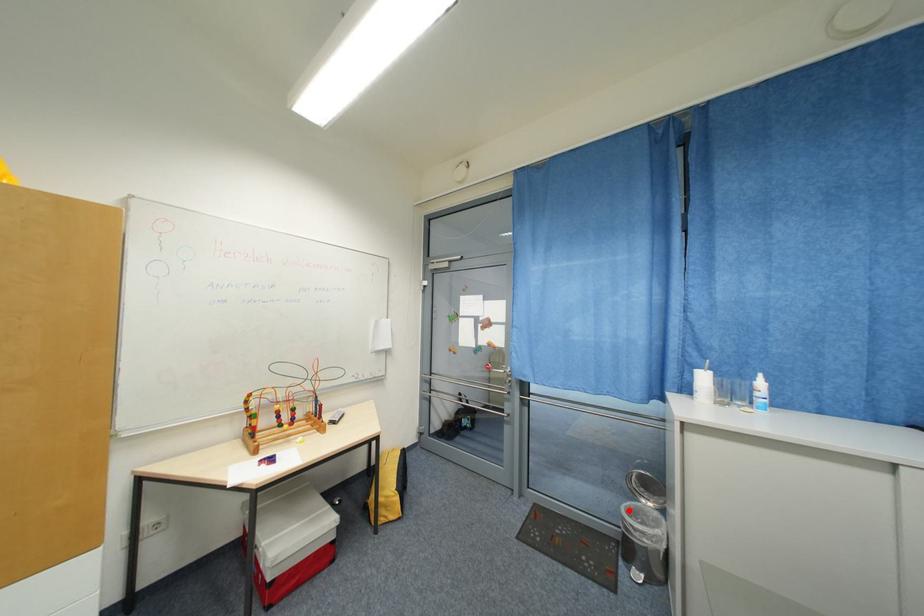
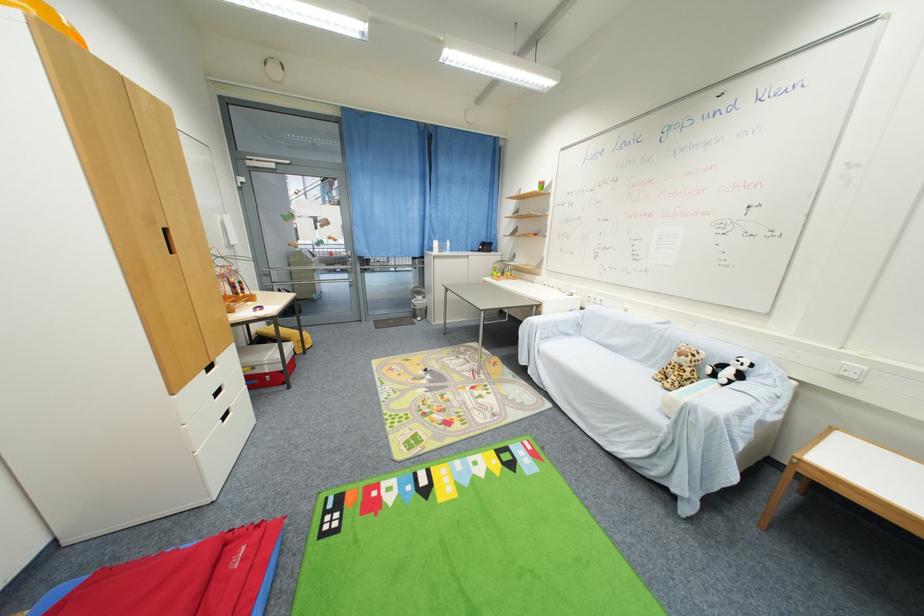
Question: I am providing you with two images of the same scene from different viewpoints. Given a red point in image1, look at the same physical point in image2. Is it:

Choices:
 (A) Closer to the viewpoint
 (B) Farther from the viewpoint

Answer: (B)